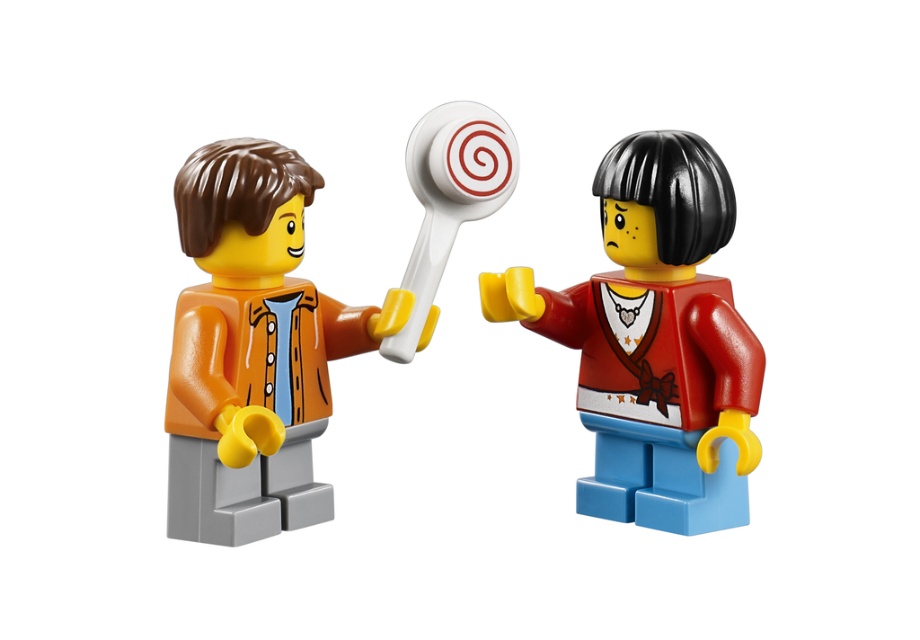
You are a photographer trying to focus on both points in the image. Which point is closer to the camera, point (548, 291) or point (260, 243)?

Point (548, 291) is further to the camera than point (260, 243), so the closer point is point (260, 243).

You are looking at the two LEGO minifigures in the image. Which of the two points, point (x=705, y=518) or point (x=486, y=204), is closer to you?

Point (x=705, y=518) is closer to the viewer than point (x=486, y=204).

You are a photographer taking a picture of two LEGO minifigures. You notice two points marked on the image at coordinates point (332, 358) and point (458, 198). Which point is closer to the camera?

Point (332, 358) is further to the camera than point (458, 198), so the closer point to the camera is point (458, 198).